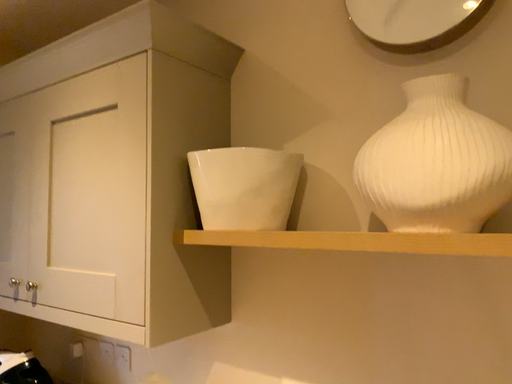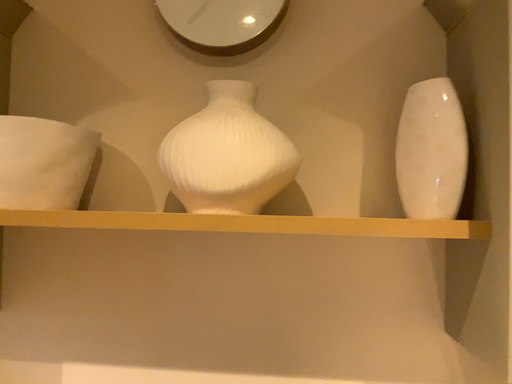
Question: Which way did the camera rotate in the video?

Choices:
 (A) rotated right
 (B) rotated left

Answer: (A)